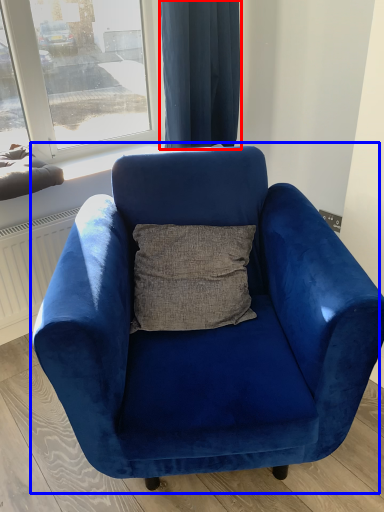
Question: Which object is closer to the camera taking this photo, curtain (highlighted by a red box) or chair (highlighted by a blue box)?

Choices:
 (A) curtain
 (B) chair

Answer: (B)